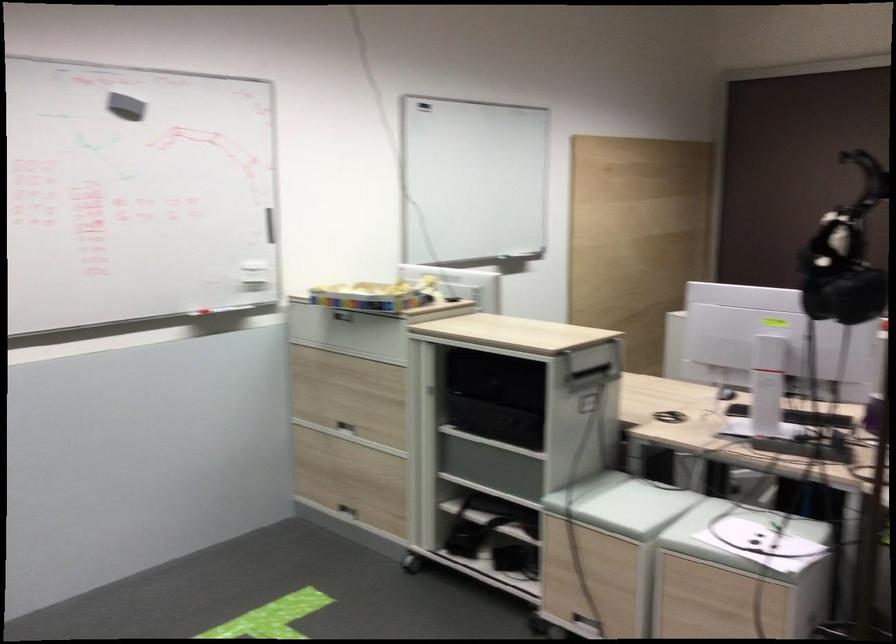
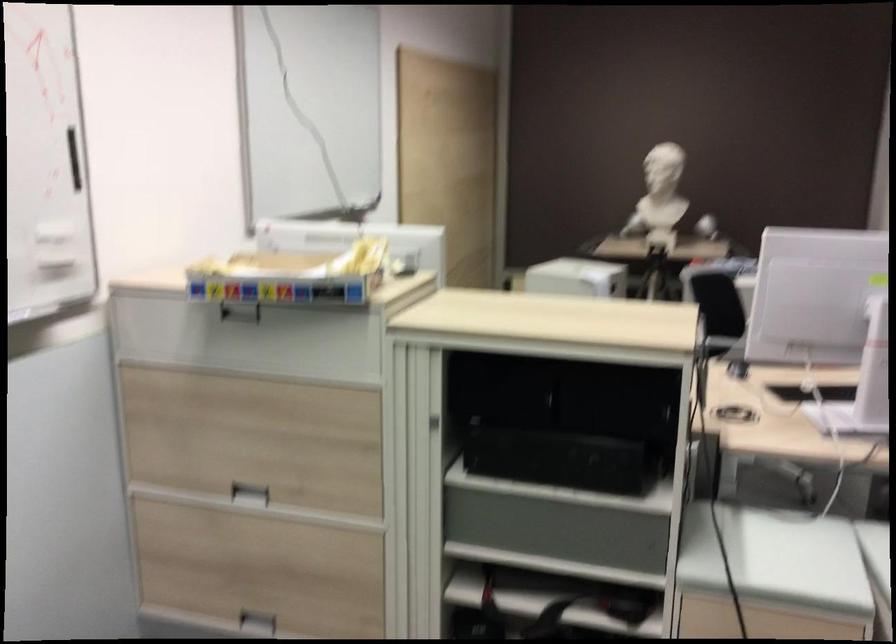
Where in the second image is the point corresponding to pixel 343 428 from the first image?

(250, 494)